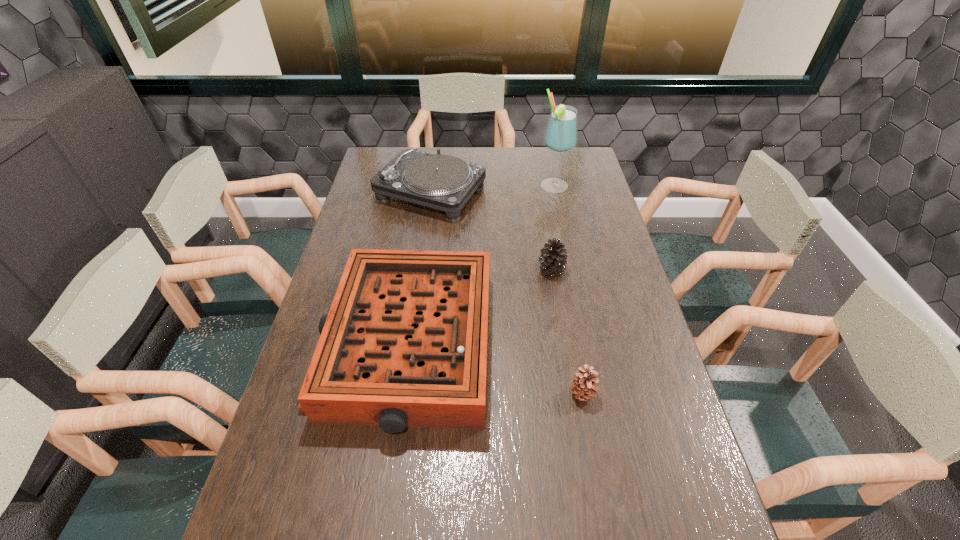
Identify the location of alcohol at the far edge. Image resolution: width=960 pixels, height=540 pixels. (561, 134).

Find the location of a particular element. This screenshot has height=540, width=960. record player that is positioned at the far edge is located at coordinates (443, 182).

This screenshot has height=540, width=960. I want to click on record player located in the left edge section of the desktop, so click(443, 182).

You are a GUI agent. You are given a task and a screenshot of the screen. Output one action in this format:
    pyautogui.click(x=<x>, y=<y>)
    Task: Click on the gameboard at the left edge
    The width and height of the screenshot is (960, 540).
    Given the screenshot: What is the action you would take?
    pyautogui.click(x=404, y=344)

At what (x,y) coordinates should I click in order to perform the action: click on object that is at the right edge. Please return your answer as a coordinate pair (x, y). The image size is (960, 540). Looking at the image, I should click on (561, 134).

Where is `object that is positioned at the far left corner`? This screenshot has width=960, height=540. object that is positioned at the far left corner is located at coordinates (443, 182).

Find the location of a particular element. object positioned at the far right corner is located at coordinates (561, 134).

Identify the location of vacant space at the far edge of the desktop. The image size is (960, 540). (511, 150).

In the image, there is a desktop. Where is `free space at the left edge`? The image size is (960, 540). free space at the left edge is located at coordinates pos(377,235).

In order to click on free region at the right edge of the desktop in this screenshot , I will do `click(578, 181)`.